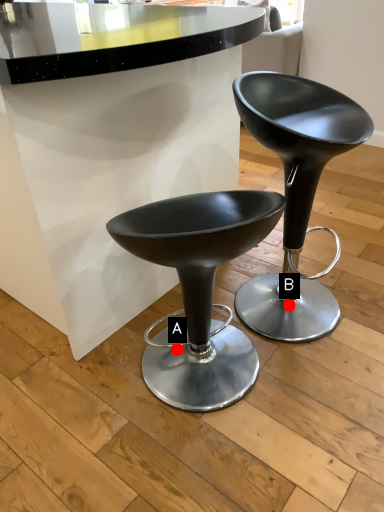
Question: Two points are circled on the image, labeled by A and B beside each circle. Which point is further to the camera?

Choices:
 (A) A is further
 (B) B is further

Answer: (A)